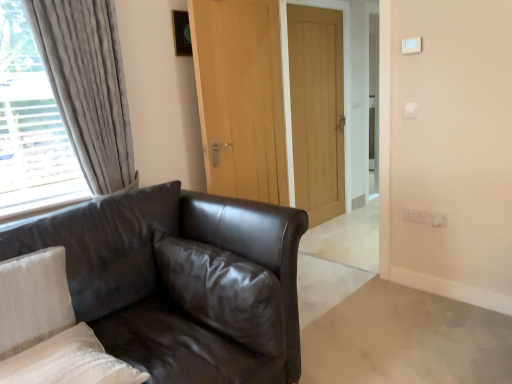
Question: Considering the positions of light brown wooden door at center, which is the 2th door from left to right, and matte black leather couch at left in the image, is light brown wooden door at center, which is the 2th door from left to right, taller or shorter than matte black leather couch at left?

Choices:
 (A) tall
 (B) short

Answer: (A)

Question: Relative to matte black leather couch at left, is light brown wooden door at center, the first door from the back, in front or behind?

Choices:
 (A) behind
 (B) front

Answer: (A)

Question: Considering the real-world distances, which object is farthest from the white plastic electric outlet at lower right, which appears as the 1th electric outlet when viewed from the right?

Choices:
 (A) white textured pillow at lower left, which is the 3th pillow from right to left
 (B) white textured pillow at lower left, marked as the second pillow in a right-to-left arrangement
 (C) matte black leather couch at left
 (D) glossy leather pillow at center, acting as the 1th pillow starting from the right
 (E) white plastic light switch at upper right, which is the first light switch from top to bottom

Answer: (A)

Question: Which object is the closest to the white plastic electric outlet at lower right, the first electric outlet positioned from the left?

Choices:
 (A) white textured pillow at lower left, the second pillow positioned from the left
 (B) light brown wooden door at center, positioned as the first door in right-to-left order
 (C) wooden door at center, which is counted as the first door, starting from the front
 (D) glossy leather pillow at center, positioned as the 3th pillow in left-to-right order
 (E) white plastic light switch at upper right, the second light switch when ordered from bottom to top

Answer: (E)